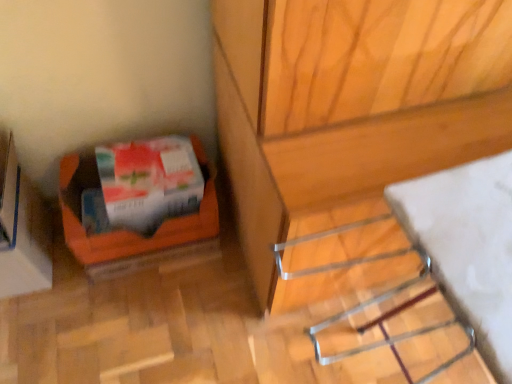
Locate an element on the screen. free location to the right of orange cardboard box at lower left is located at coordinates (99, 287).